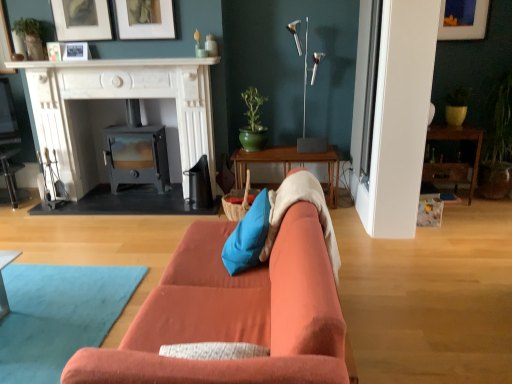
Question: Is point (112, 180) closer or farther from the camera than point (266, 337)?

Choices:
 (A) farther
 (B) closer

Answer: (A)

Question: From the image's perspective, is metallic gray wood burning stove at center located above or below orange fabric couch at center?

Choices:
 (A) below
 (B) above

Answer: (B)

Question: Estimate the real-world distances between objects in this image. Which object is closer to the metallic gray wood burning stove at center?

Choices:
 (A) matte white picture frame at upper right, which is counted as the fifth picture frame, starting from the left
 (B) orange fabric couch at center
 (C) blue fabric pillow at center
 (D) wooden table at center, which is counted as the second table, starting from the right
 (E) silver metallic floor lamp at upper center

Answer: (D)

Question: Estimate the real-world distances between objects in this image. Which object is closer to the matte white picture frame at upper center, positioned as the 2th picture frame in right-to-left order?

Choices:
 (A) silver metallic floor lamp at upper center
 (B) blue fabric pillow at center
 (C) metallic gray wood burning stove at center
 (D) matte white picture frame at upper right, which is counted as the fifth picture frame, starting from the left
 (E) matte black picture frame at upper left, the 3th picture frame when ordered from left to right

Answer: (E)